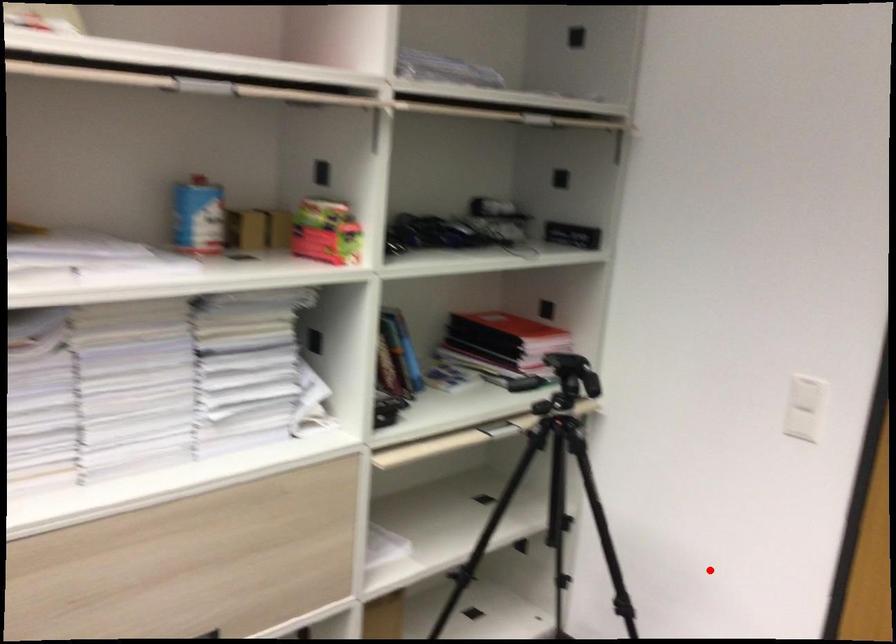
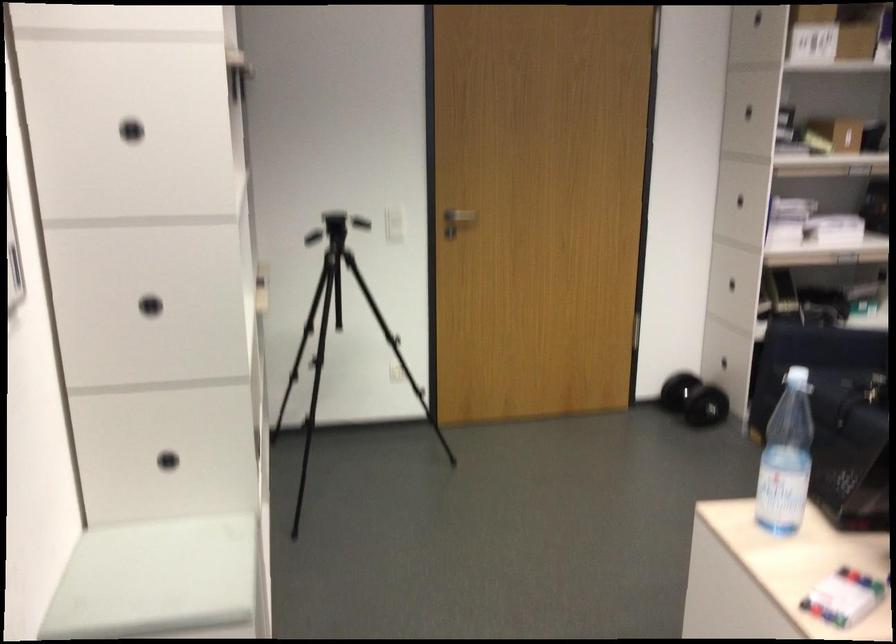
Locate, in the second image, the point that corresponds to the highlighted location in the first image.

(339, 334)